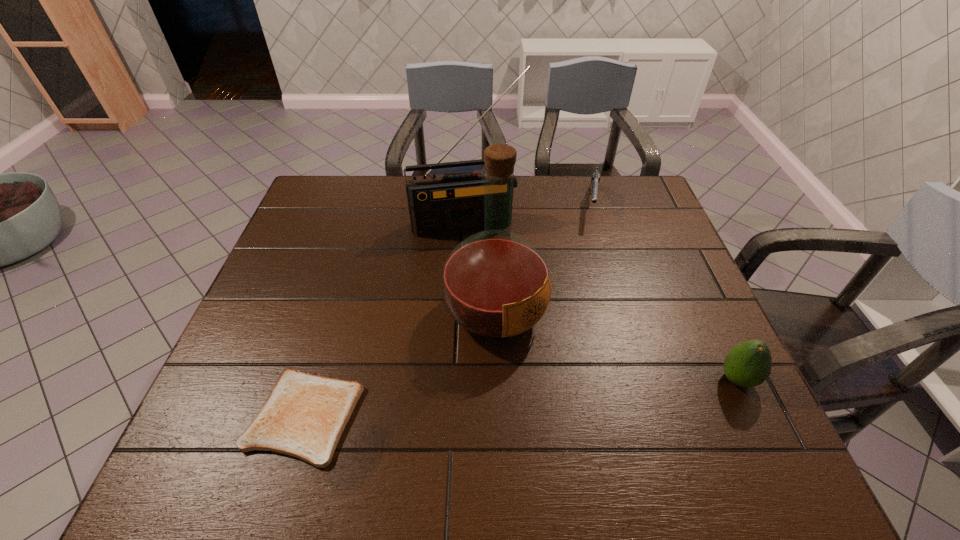
Image resolution: width=960 pixels, height=540 pixels. Identify the location of free space located 0.050m on the front-facing side of the radio receiver. (478, 248).

Identify the location of vacant region located on the front-facing side of the radio receiver. (488, 285).

At what (x,y) coordinates should I click in order to perform the action: click on blank area located on the front-facing side of the radio receiver. Please return your answer as a coordinate pair (x, y). Image resolution: width=960 pixels, height=540 pixels. Looking at the image, I should click on (481, 259).

I want to click on vacant space located on the front label of the liquor, so click(x=579, y=384).

Image resolution: width=960 pixels, height=540 pixels. I want to click on vacant point located 0.160m on the front label of the liquor, so click(x=586, y=390).

Where is `vacant area situated on the front label of the liquor`? This screenshot has height=540, width=960. vacant area situated on the front label of the liquor is located at coordinates (558, 366).

Locate an element on the screen. free space located aiming along the barrel of the fourth object from left to right is located at coordinates (590, 298).

You are a GUI agent. You are given a task and a screenshot of the screen. Output one action in this format:
    pyautogui.click(x=<x>, y=<y>)
    Task: Click on the vacant space located 0.110m aiming along the barrel of the fourth object from left to right
    This screenshot has height=540, width=960.
    Given the screenshot: What is the action you would take?
    pyautogui.click(x=593, y=248)

In order to click on free space located 0.260m aiming along the barrel of the fourth object from left to right in this screenshot , I will do `click(591, 285)`.

Where is `radio receiver that is positioned at the far edge`? The image size is (960, 540). radio receiver that is positioned at the far edge is located at coordinates (438, 204).